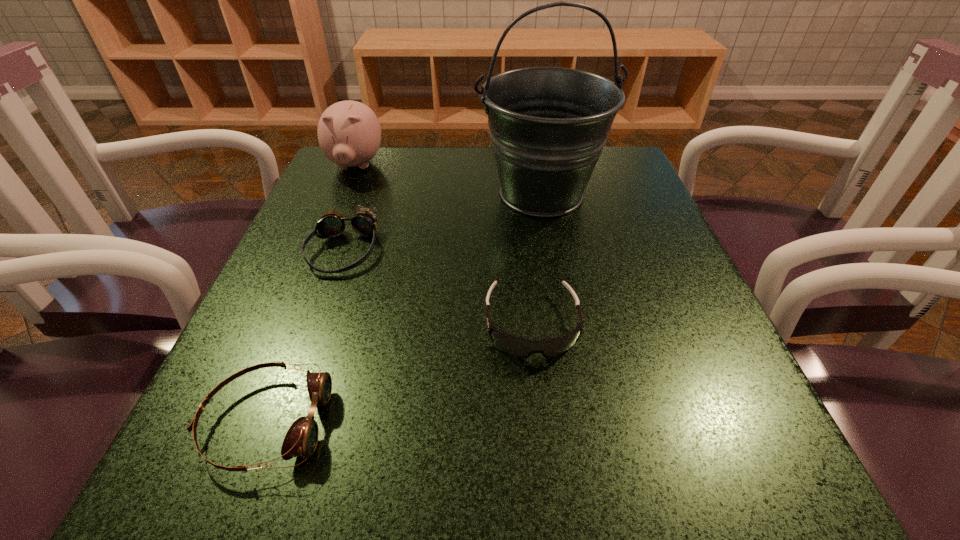
The height and width of the screenshot is (540, 960). Identify the location of free region that satisfies the following two spatial constraints: 1. through the lenses of the farthest goggles; 2. through the lenses of the nearest object. pyautogui.click(x=281, y=422).